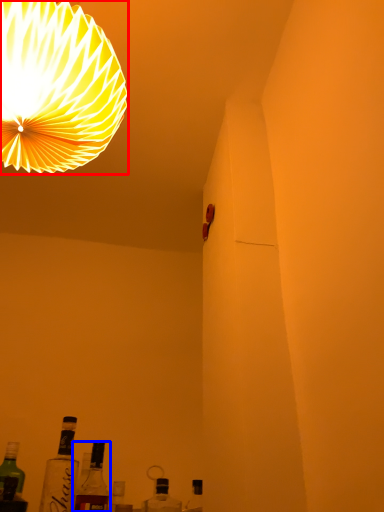
Question: Among these objects, which one is farthest to the camera, lamp (highlighted by a red box) or bottle (highlighted by a blue box)?

Choices:
 (A) lamp
 (B) bottle

Answer: (B)